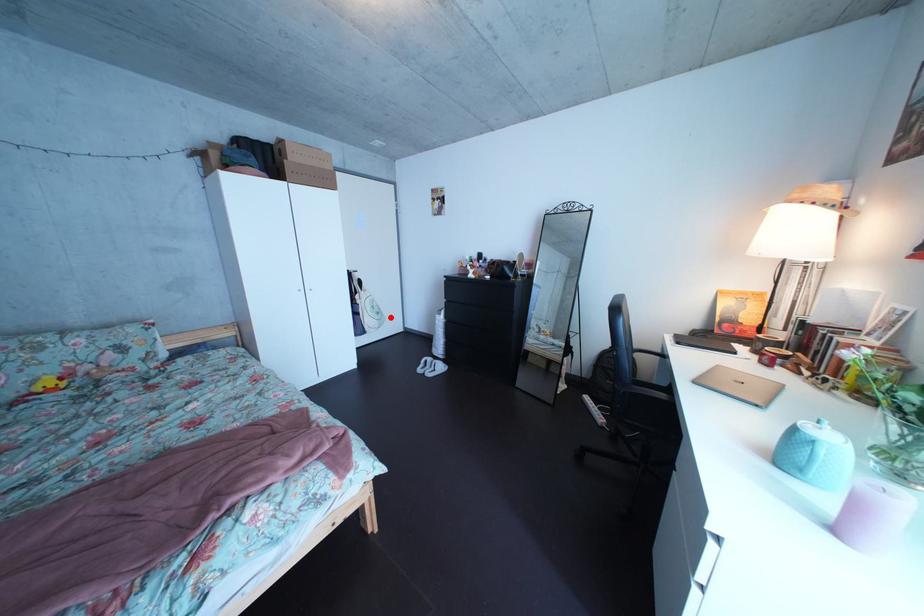
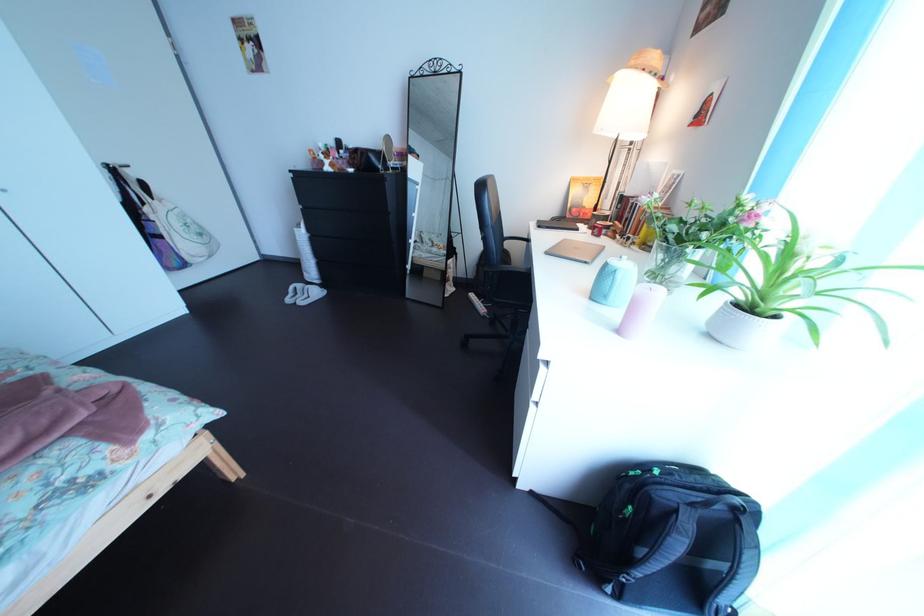
Question: A red point is marked in image1. In image2, is the corresponding 3D point closer to the camera or farther? Reply with the corresponding letter.

Choices:
 (A) The corresponding 3D point is closer.
 (B) The corresponding 3D point is farther.

Answer: (A)